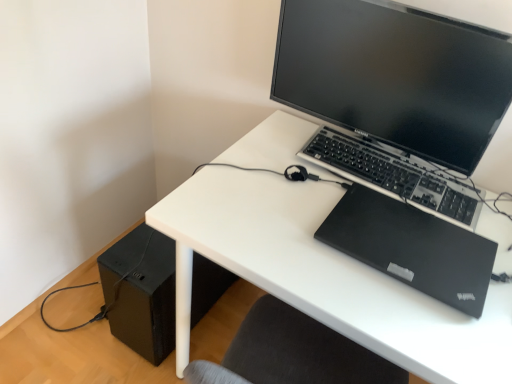
Find the location of `space that is in front of black matte laptop at upper right`. space that is in front of black matte laptop at upper right is located at coordinates (419, 324).